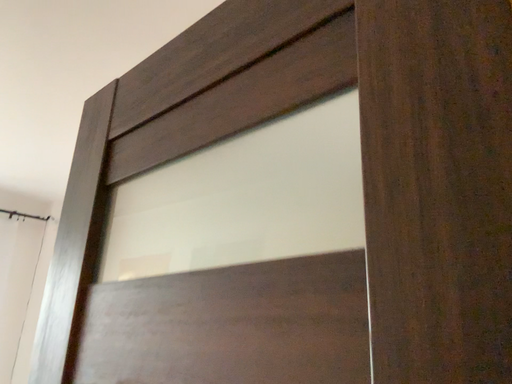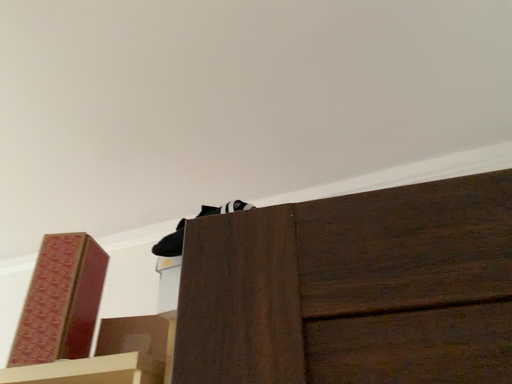
Question: How did the camera likely rotate when shooting the video?

Choices:
 (A) rotated right
 (B) rotated left

Answer: (A)